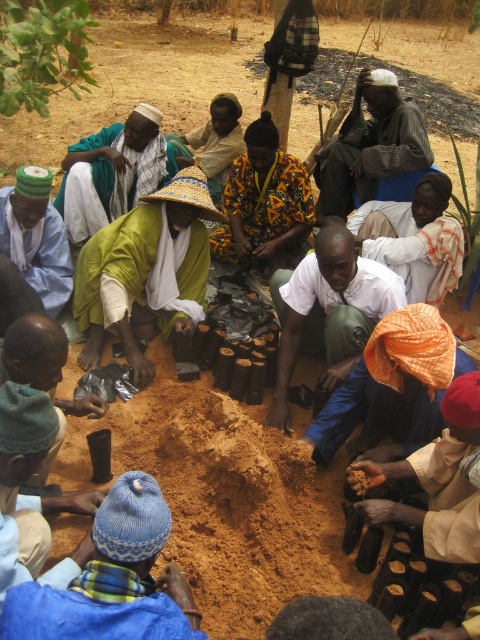
You are a photographer standing in the middle of the sandy area and want to capture both the orange fabric at lower right and the knitted woolen cap at lower left in your shot. Which object should you adjust your camera focus on first to ensure it appears clearer in the photo?

The orange fabric at lower right should be focused on first because it is closer to the viewer than the knitted woolen cap at lower left, so adjusting focus on it will ensure clarity before the cap in the background.

You are a photographer trying to capture a closeup of the knitted woolen cap at lower left and the green fabric hat at lower left. Since you want to focus on both, which one should you adjust your camera to focus on first?

The knitted woolen cap at lower left is located below the green fabric hat at lower left, so you should focus on the knitted woolen cap at lower left first as it is closer to the camera.